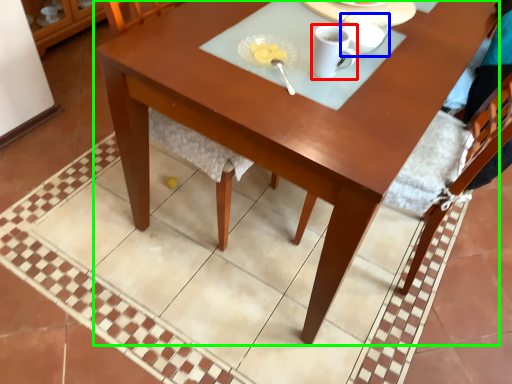
Question: Which is nearer to the coffee cup (highlighted by a red box)? tableware (highlighted by a blue box) or desk (highlighted by a green box).

Choices:
 (A) tableware
 (B) desk

Answer: (A)